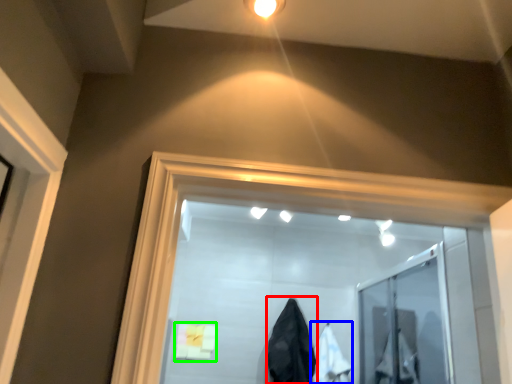
Question: Estimate the real-world distances between objects in this image. Which object is closer to garment (highlighted by a red box), garment (highlighted by a blue box) or bath towel (highlighted by a green box)?

Choices:
 (A) garment
 (B) bath towel

Answer: (A)